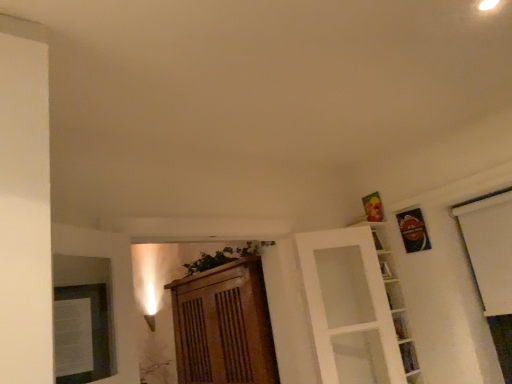
Question: Are clear glass shelf at lower right, the first shelf when ordered from bottom to top, and wooden cabinet at center far apart?

Choices:
 (A) yes
 (B) no

Answer: (A)

Question: Is clear glass shelf at lower right, which is counted as the second shelf, starting from the top, smaller than wooden cabinet at center?

Choices:
 (A) no
 (B) yes

Answer: (B)

Question: Is wooden cabinet at center at the back of clear glass shelf at lower right, the first shelf when ordered from bottom to top?

Choices:
 (A) yes
 (B) no

Answer: (A)

Question: Does clear glass shelf at lower right, which is counted as the second shelf, starting from the top, have a lesser height compared to wooden cabinet at center?

Choices:
 (A) yes
 (B) no

Answer: (A)

Question: Does clear glass shelf at lower right, which is counted as the second shelf, starting from the top, have a larger size compared to wooden cabinet at center?

Choices:
 (A) no
 (B) yes

Answer: (A)

Question: In terms of height, does wooden cabinet at center look taller or shorter compared to clear glass shelf at lower right, which is counted as the second shelf, starting from the top?

Choices:
 (A) short
 (B) tall

Answer: (B)

Question: Would you say wooden cabinet at center is to the left or to the right of clear glass shelf at lower right, which is counted as the second shelf, starting from the top, in the picture?

Choices:
 (A) right
 (B) left

Answer: (B)

Question: From a real-world perspective, is wooden cabinet at center physically located above or below clear glass shelf at lower right, the first shelf when ordered from bottom to top?

Choices:
 (A) above
 (B) below

Answer: (A)

Question: From the image's perspective, is wooden cabinet at center above or below clear glass shelf at lower right, which is counted as the second shelf, starting from the top?

Choices:
 (A) above
 (B) below

Answer: (B)

Question: Is clear glass shelf at lower right, which is counted as the second shelf, starting from the top, in front of or behind wooden cabinet at center in the image?

Choices:
 (A) behind
 (B) front

Answer: (A)

Question: Is clear glass shelf at lower right, which is counted as the second shelf, starting from the top, situated inside wooden cabinet at center or outside?

Choices:
 (A) inside
 (B) outside

Answer: (B)

Question: Looking at the image, does clear glass shelf at lower right, which is counted as the second shelf, starting from the top, seem bigger or smaller compared to wooden cabinet at center?

Choices:
 (A) small
 (B) big

Answer: (A)

Question: From a real-world perspective, is clear glass shelf at lower right, which is counted as the second shelf, starting from the top, positioned above or below wooden cabinet at center?

Choices:
 (A) below
 (B) above

Answer: (A)

Question: Visually, is white glass door at upper right positioned to the left or to the right of clear glass shelf at lower right, which is counted as the second shelf, starting from the top?

Choices:
 (A) left
 (B) right

Answer: (A)

Question: Is point (359, 382) positioned closer to the camera than point (401, 349)?

Choices:
 (A) closer
 (B) farther

Answer: (B)